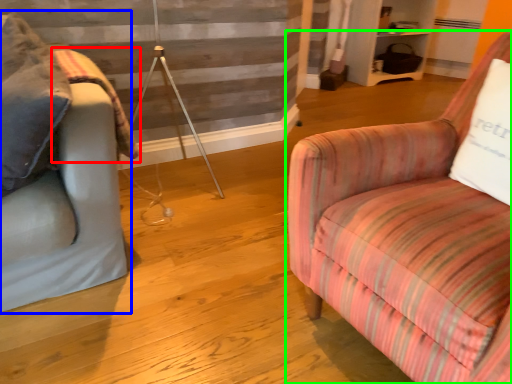
Question: Considering the real-world distances, which object is closest to blanket (highlighted by a red box)? studio couch (highlighted by a blue box) or chair (highlighted by a green box).

Choices:
 (A) studio couch
 (B) chair

Answer: (A)